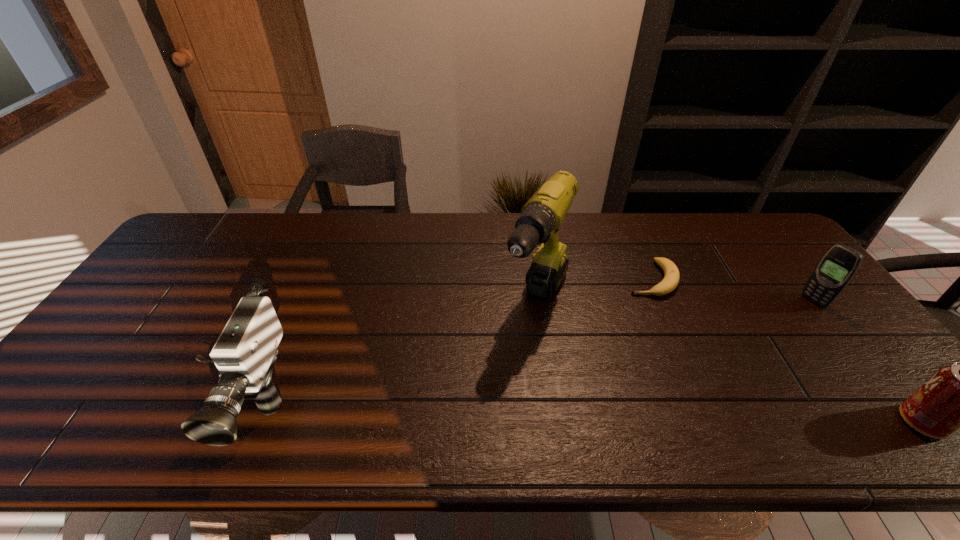
Find the location of a particular element. free location that satisfies the following two spatial constraints: 1. on the recording direction of the soda can; 2. on the right side of the camcorder is located at coordinates (231, 422).